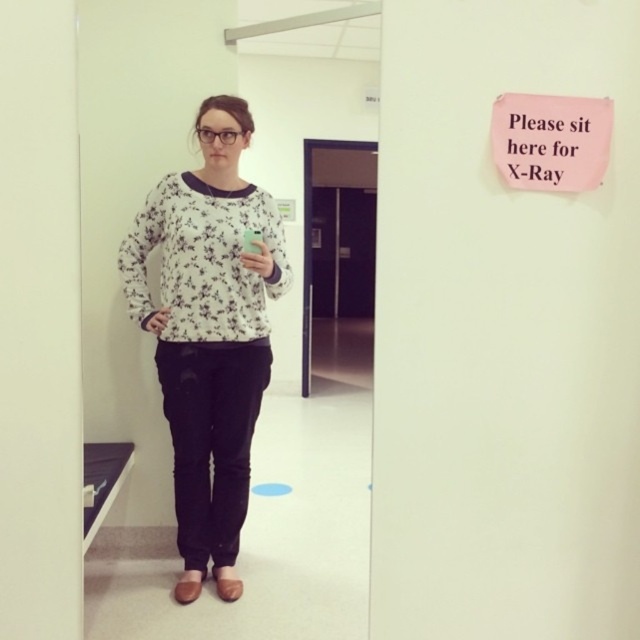
Is white floral sweater at center smaller than pink paper sign at upper right?

Actually, white floral sweater at center might be larger than pink paper sign at upper right.

Is white floral sweater at center taller than pink paper sign at upper right?

Indeed, white floral sweater at center has a greater height compared to pink paper sign at upper right.

This screenshot has width=640, height=640. Describe the element at coordinates (209, 332) in the screenshot. I see `white floral sweater at center` at that location.

Where is `white floral sweater at center`? white floral sweater at center is located at coordinates (209, 332).